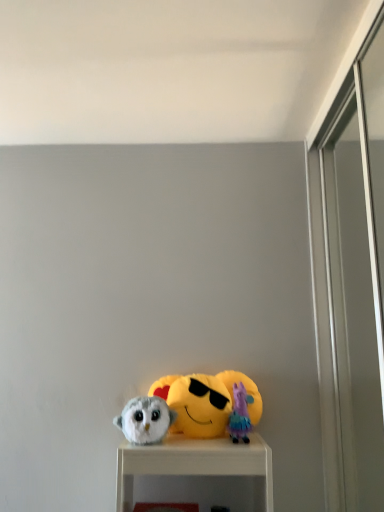
Question: Is plush purple at center, the first toy viewed from the right, smaller than fluffy white owl at lower left, the second toy when ordered from right to left?

Choices:
 (A) no
 (B) yes

Answer: (B)

Question: From a real-world perspective, does plush purple at center, the first toy viewed from the right, stand above fluffy white owl at lower left, which is the first toy from left to right?

Choices:
 (A) yes
 (B) no

Answer: (A)

Question: Is plush purple at center, the first toy viewed from the right, to the right of fluffy white owl at lower left, which is the first toy from left to right, from the viewer's perspective?

Choices:
 (A) no
 (B) yes

Answer: (B)

Question: From a real-world perspective, is plush purple at center, marked as the second toy in a left-to-right arrangement, physically below fluffy white owl at lower left, which is the first toy from left to right?

Choices:
 (A) no
 (B) yes

Answer: (A)

Question: Does plush purple at center, marked as the second toy in a left-to-right arrangement, come behind fluffy white owl at lower left, which is the first toy from left to right?

Choices:
 (A) no
 (B) yes

Answer: (B)

Question: Is yellow plush at center taller or shorter than fluffy white owl at lower left, the second toy when ordered from right to left?

Choices:
 (A) tall
 (B) short

Answer: (A)

Question: Is yellow plush at center wider or thinner than fluffy white owl at lower left, the second toy when ordered from right to left?

Choices:
 (A) thin
 (B) wide

Answer: (A)

Question: Based on their positions, is yellow plush at center located to the left or right of fluffy white owl at lower left, which is the first toy from left to right?

Choices:
 (A) right
 (B) left

Answer: (A)

Question: Does point coord(185,417) appear closer or farther from the camera than point coord(142,401)?

Choices:
 (A) closer
 (B) farther

Answer: (B)

Question: Visually, is plush purple at center, the first toy viewed from the right, positioned to the left or to the right of yellow plush at center?

Choices:
 (A) left
 (B) right

Answer: (B)

Question: From their relative heights in the image, would you say plush purple at center, the first toy viewed from the right, is taller or shorter than yellow plush at center?

Choices:
 (A) short
 (B) tall

Answer: (A)

Question: From a real-world perspective, relative to yellow plush at center, is plush purple at center, marked as the second toy in a left-to-right arrangement, vertically above or below?

Choices:
 (A) above
 (B) below

Answer: (B)

Question: Is plush purple at center, marked as the second toy in a left-to-right arrangement, wider or thinner than yellow plush at center?

Choices:
 (A) thin
 (B) wide

Answer: (B)

Question: From their relative heights in the image, would you say fluffy white owl at lower left, which is the first toy from left to right, is taller or shorter than plush purple at center, the first toy viewed from the right?

Choices:
 (A) short
 (B) tall

Answer: (A)

Question: Is point 155,408 positioned closer to the camera than point 249,399?

Choices:
 (A) farther
 (B) closer

Answer: (B)